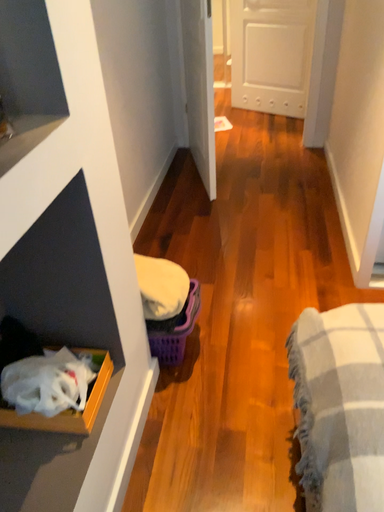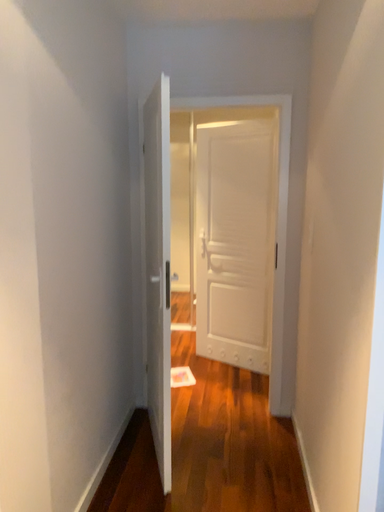
Question: How did the camera likely rotate when shooting the video?

Choices:
 (A) rotated downward
 (B) rotated upward

Answer: (B)